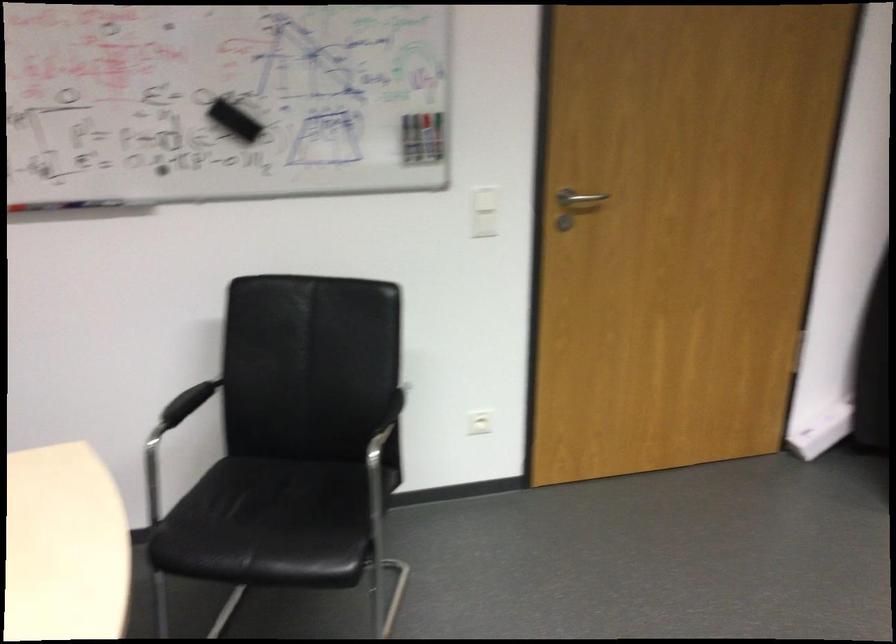
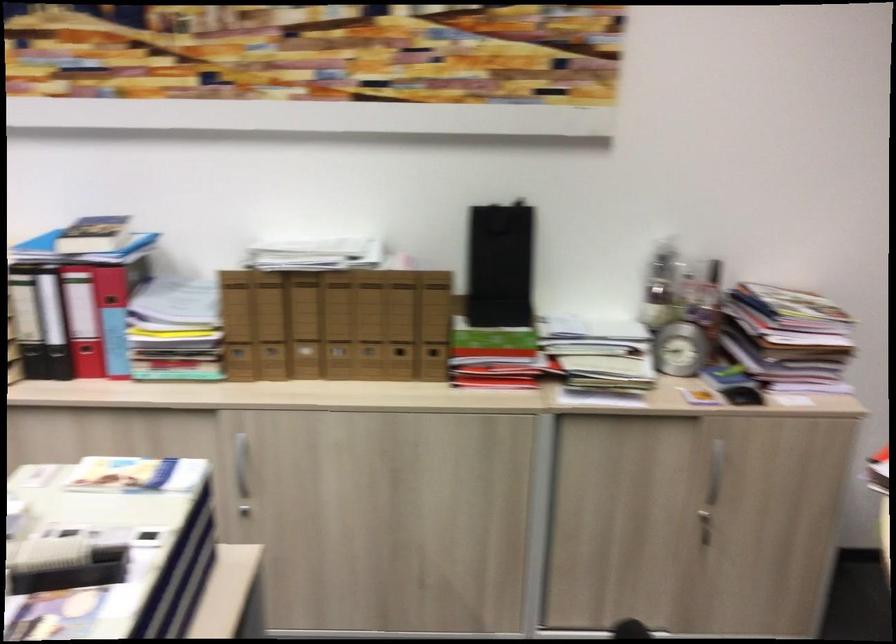
How did the camera likely rotate?

The camera's rotation is toward left-down.